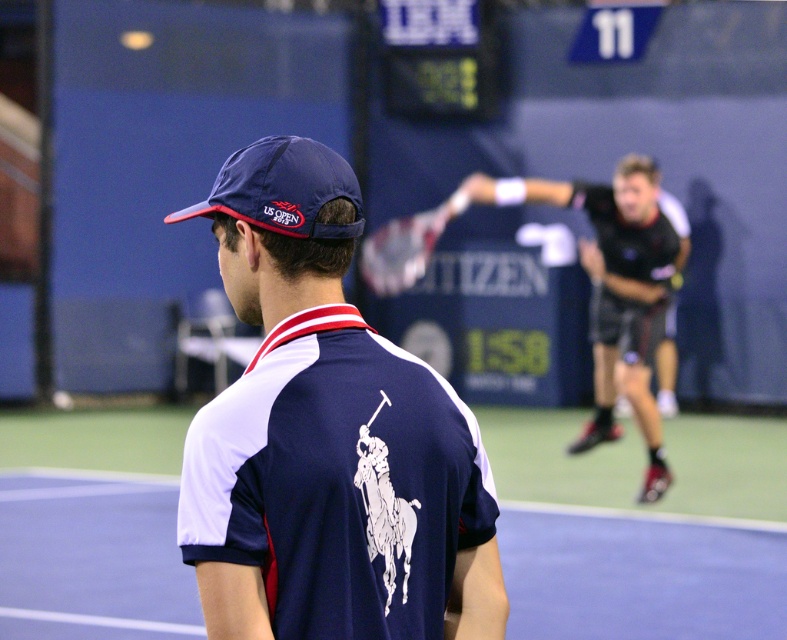
The width and height of the screenshot is (787, 640). What do you see at coordinates (614, 291) in the screenshot?
I see `black synthetic tennis racket at upper right` at bounding box center [614, 291].

Which is behind, point (614, 308) or point (305, 218)?

Point (614, 308)

Where is `black synthetic tennis racket at upper right`? Image resolution: width=787 pixels, height=640 pixels. black synthetic tennis racket at upper right is located at coordinates (614, 291).

Looking at this image, between black synthetic tennis racket at upper right and white textured racket at center, which one is positioned higher?

white textured racket at center is above.

Which is in front, point (479, 189) or point (420, 275)?

Positioned in front is point (479, 189).

The width and height of the screenshot is (787, 640). Describe the element at coordinates (614, 291) in the screenshot. I see `black synthetic tennis racket at upper right` at that location.

Identify the location of black synthetic tennis racket at upper right. This screenshot has height=640, width=787. (614, 291).

How much distance is there between navy blue fabric cap at upper center and white textured racket at center?

navy blue fabric cap at upper center is 61.51 feet away from white textured racket at center.

Does navy blue fabric cap at upper center appear over white textured racket at center?

No, navy blue fabric cap at upper center is not above white textured racket at center.

Describe the element at coordinates (283, 188) in the screenshot. I see `navy blue fabric cap at upper center` at that location.

The height and width of the screenshot is (640, 787). Identify the location of navy blue fabric cap at upper center. pos(283,188).